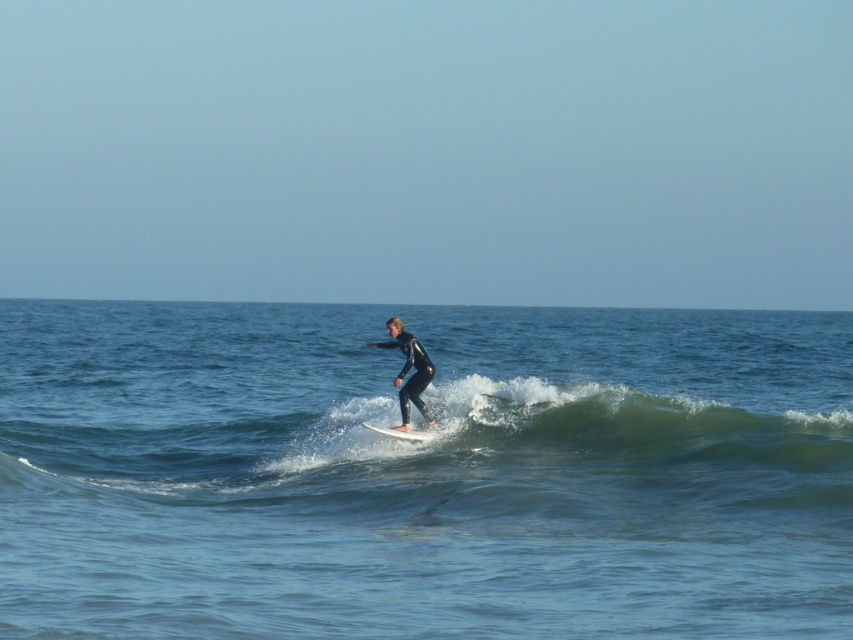
Question: Is clear blue water at wave center to the right of white smooth surfboard at center from the viewer's perspective?

Choices:
 (A) no
 (B) yes

Answer: (A)

Question: Is clear blue water at wave center positioned in front of white smooth surfboard at center?

Choices:
 (A) yes
 (B) no

Answer: (A)

Question: Which point is farther from the camera taking this photo?

Choices:
 (A) click(x=427, y=426)
 (B) click(x=418, y=432)

Answer: (A)

Question: Which point appears farthest from the camera in this image?

Choices:
 (A) (415, 381)
 (B) (618, 456)
 (C) (416, 433)

Answer: (C)

Question: Can you confirm if black matte wetsuit at center is thinner than white smooth surfboard at center?

Choices:
 (A) yes
 (B) no

Answer: (A)

Question: Which object appears closest to the camera in this image?

Choices:
 (A) black matte wetsuit at center
 (B) clear blue water at wave center
 (C) white smooth surfboard at center

Answer: (B)